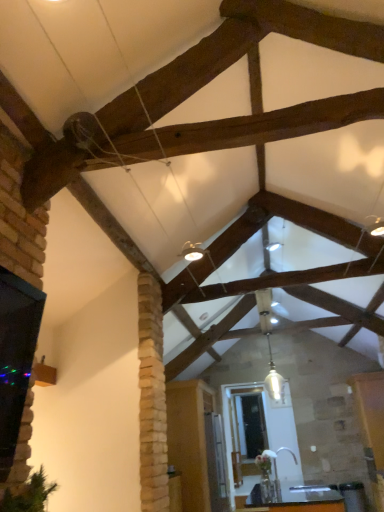
Question: Considering the relative sizes of white glass pendant light at center and black glass window at left in the image provided, is white glass pendant light at center shorter than black glass window at left?

Choices:
 (A) yes
 (B) no

Answer: (B)

Question: From the image's perspective, is white glass pendant light at center located above black glass window at left?

Choices:
 (A) no
 (B) yes

Answer: (A)

Question: Can you confirm if white glass pendant light at center is thinner than black glass window at left?

Choices:
 (A) yes
 (B) no

Answer: (A)

Question: Does white glass pendant light at center appear on the left side of black glass window at left?

Choices:
 (A) no
 (B) yes

Answer: (A)

Question: Is white glass pendant light at center turned away from black glass window at left?

Choices:
 (A) yes
 (B) no

Answer: (A)

Question: Is black glass window at left bigger or smaller than white glass pendant light at center?

Choices:
 (A) small
 (B) big

Answer: (B)

Question: From their relative heights in the image, would you say black glass window at left is taller or shorter than white glass pendant light at center?

Choices:
 (A) short
 (B) tall

Answer: (A)

Question: Considering the positions of black glass window at left and white glass pendant light at center in the image, is black glass window at left wider or thinner than white glass pendant light at center?

Choices:
 (A) thin
 (B) wide

Answer: (B)

Question: Considering the positions of point (8, 385) and point (268, 337), is point (8, 385) closer or farther from the camera than point (268, 337)?

Choices:
 (A) closer
 (B) farther

Answer: (A)

Question: Considering the relative positions of white glass pendant light at center and black glass window at left in the image provided, is white glass pendant light at center to the left or to the right of black glass window at left?

Choices:
 (A) right
 (B) left

Answer: (A)

Question: From the image's perspective, is white glass pendant light at center above or below black glass window at left?

Choices:
 (A) below
 (B) above

Answer: (A)

Question: Is white glass pendant light at center spatially inside black glass window at left, or outside of it?

Choices:
 (A) inside
 (B) outside

Answer: (B)

Question: Does point (266, 334) appear closer or farther from the camera than point (24, 294)?

Choices:
 (A) closer
 (B) farther

Answer: (B)

Question: In terms of width, does black glass window at left look wider or thinner when compared to wooden table at lower center?

Choices:
 (A) thin
 (B) wide

Answer: (A)

Question: From a real-world perspective, is black glass window at left positioned above or below wooden table at lower center?

Choices:
 (A) above
 (B) below

Answer: (A)